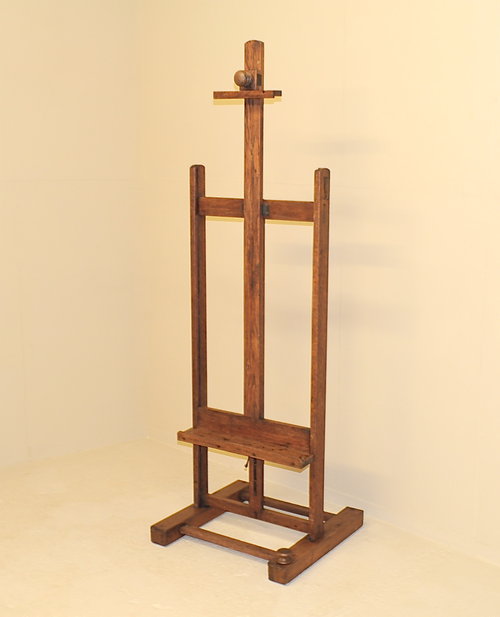
Locate an element on the screen. Image resolution: width=500 pixels, height=617 pixels. wall is located at coordinates (406, 371), (91, 387).